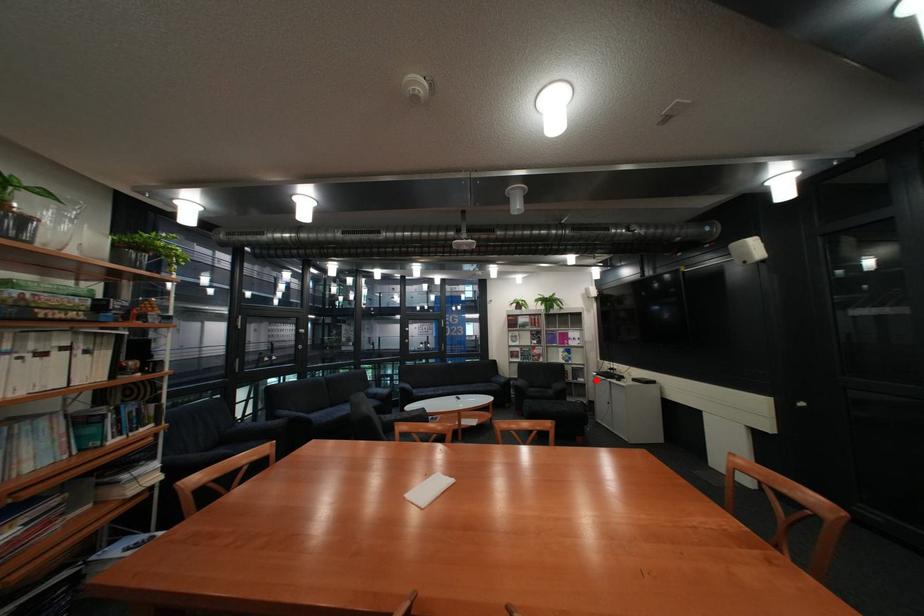
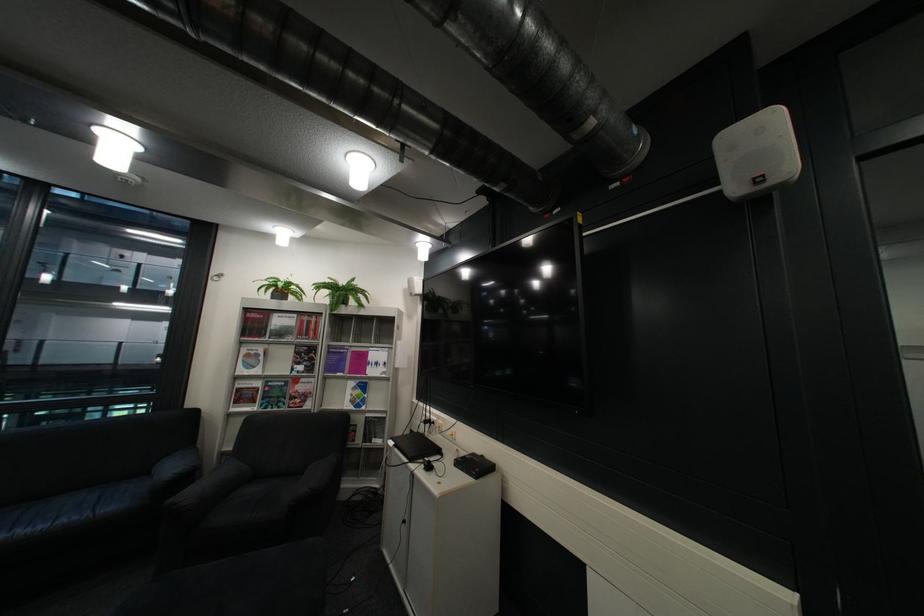
Question: I am providing you with two images of the same scene from different viewpoints. In image1, a red point is highlighted. Considering the same 3D point in image2, which of the following is correct?

Choices:
 (A) It is closer
 (B) It is farther

Answer: (A)